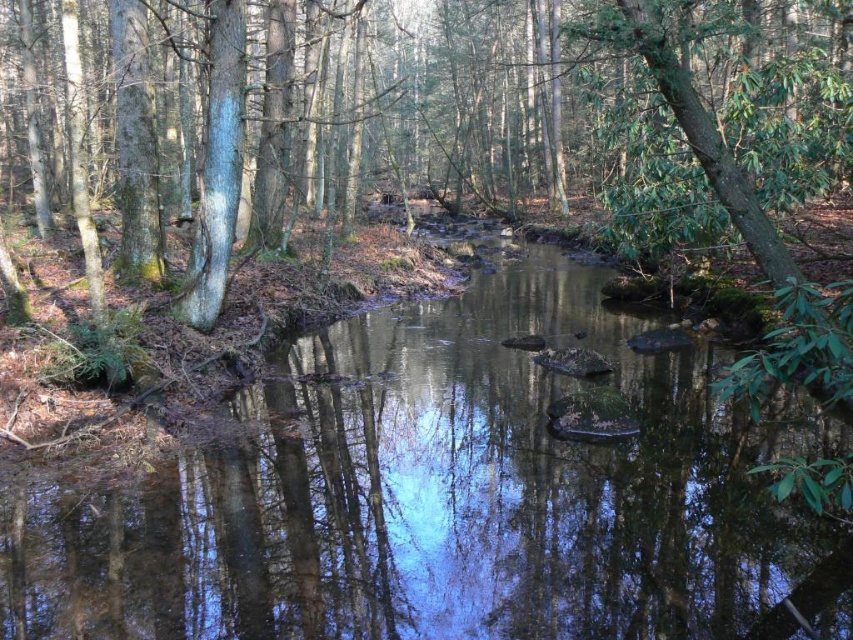
Question: Where is clear water at center located in relation to green leafy tree at center in the image?

Choices:
 (A) above
 (B) below

Answer: (B)

Question: Which object is farther from the camera taking this photo?

Choices:
 (A) clear water at center
 (B) green leafy tree at center

Answer: (A)

Question: Can you confirm if clear water at center is positioned to the right of green leafy tree at center?

Choices:
 (A) yes
 (B) no

Answer: (A)

Question: Is clear water at center to the left of green leafy tree at center from the viewer's perspective?

Choices:
 (A) yes
 (B) no

Answer: (B)